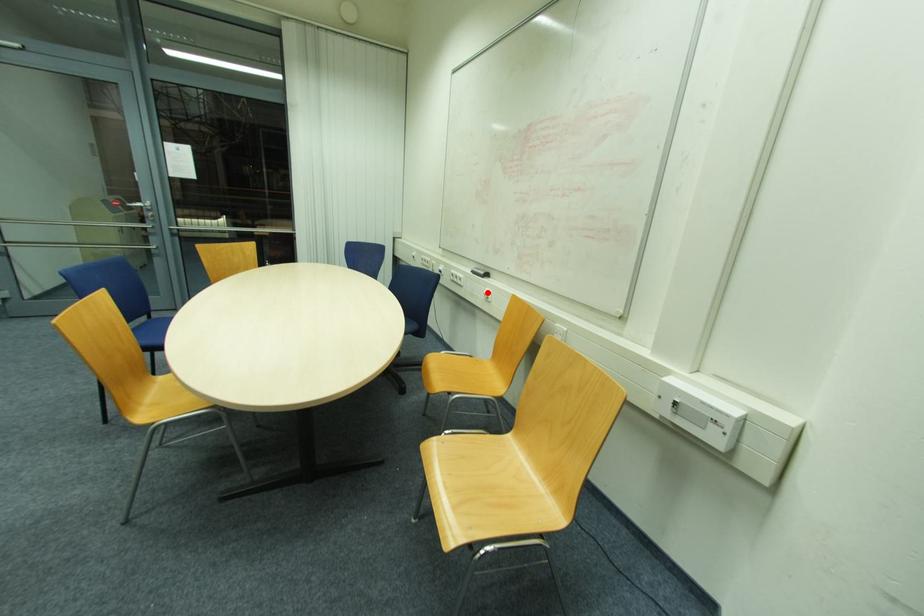
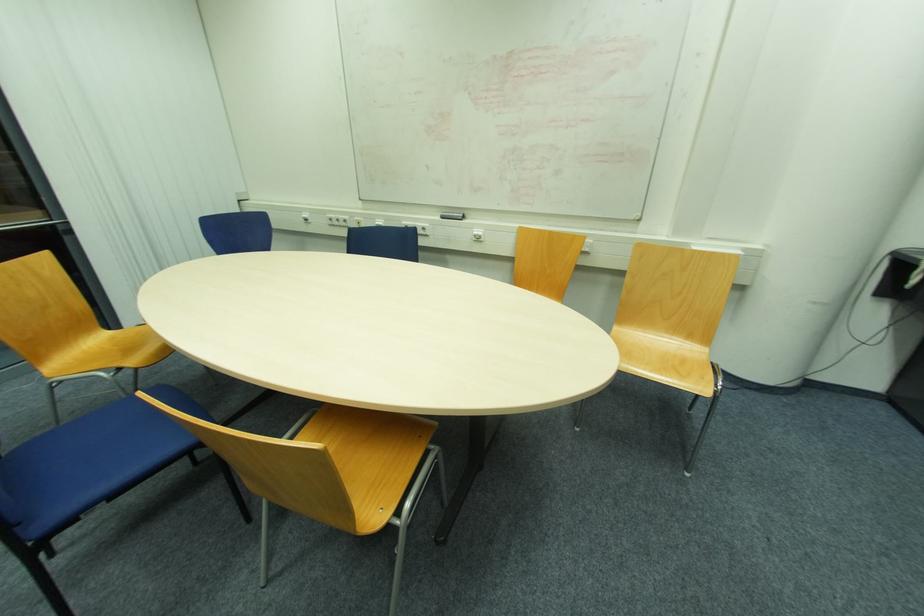
Where in the second image is the point corresponding to the highlighted location from the first image?

(477, 233)